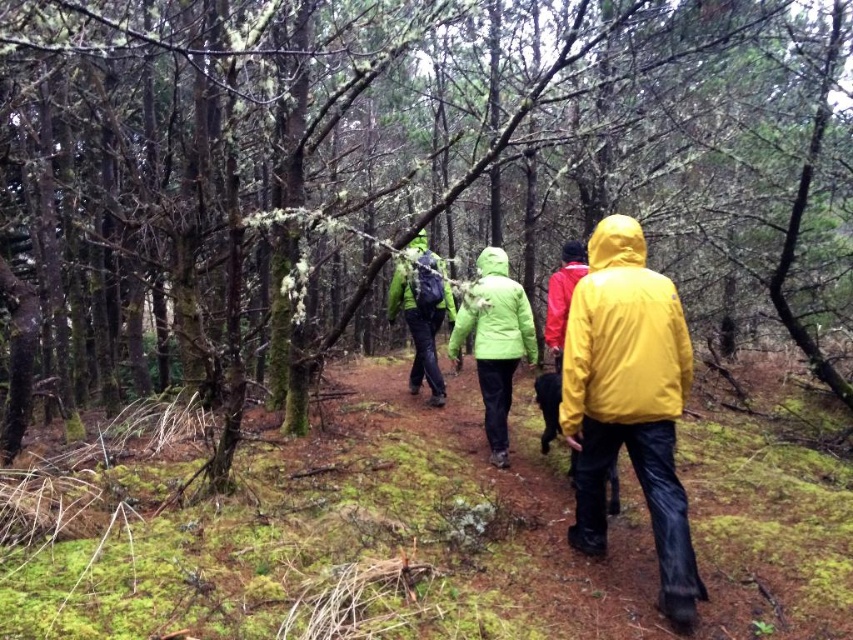
You are a hiker navigating through the dense forest depicted in the image. You notice two points marked on the ground ahead of you. The first point is located at coordinates point (573, 406), and the second is at point (527, 301). Which of these two points is closer to your current position?

Point (573, 406) is closer to the camera than point (527, 301), so the first point is closer to your current position.

You are standing in the forest and see the yellow matte jacket at center. If you want to reach the jacket, how many steps would you need to take if each step covers 1.5 feet?

The yellow matte jacket at center is 6.09 feet away from the viewer. Since each step covers 1.5 feet, you would need approximately 4 steps to reach it.

You are one of the hikers in the dense forest scene. You notice two hikers wearing jackets. The first is wearing a yellow matte jacket at center, and the second is wearing a red matte jacket at center. Which hiker is standing closer to you?

The yellow matte jacket at center is closer to the viewer than the red matte jacket at center, so the hiker wearing the yellow matte jacket at center is standing closer to you.